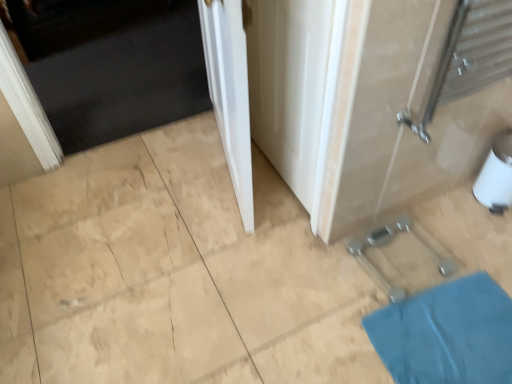
Question: Is white glossy door at upper left, which is counted as the first door, starting from the left, further to the viewer compared to blue fabric bath mat at lower right?

Choices:
 (A) no
 (B) yes

Answer: (B)

Question: Could you tell me if white glossy door at upper left, which is counted as the first door, starting from the left, is turned towards blue fabric bath mat at lower right?

Choices:
 (A) no
 (B) yes

Answer: (B)

Question: From a real-world perspective, is white glossy door at upper left, acting as the second door starting from the front, on top of blue fabric bath mat at lower right?

Choices:
 (A) yes
 (B) no

Answer: (B)

Question: From the image's perspective, is white glossy door at upper left, which is counted as the first door, starting from the left, beneath blue fabric bath mat at lower right?

Choices:
 (A) yes
 (B) no

Answer: (B)

Question: Is the depth of white glossy door at upper left, acting as the second door starting from the front, less than that of blue fabric bath mat at lower right?

Choices:
 (A) no
 (B) yes

Answer: (A)

Question: From the image's perspective, is white glossy door at upper left, which ranks as the second door in right-to-left order, on top of blue fabric bath mat at lower right?

Choices:
 (A) yes
 (B) no

Answer: (A)

Question: Does white glossy door at center appear on the left side of blue fabric bath mat at lower right?

Choices:
 (A) yes
 (B) no

Answer: (A)

Question: From the image's perspective, is white glossy door at center beneath blue fabric bath mat at lower right?

Choices:
 (A) no
 (B) yes

Answer: (A)

Question: Is white glossy door at center positioned with its back to blue fabric bath mat at lower right?

Choices:
 (A) no
 (B) yes

Answer: (A)

Question: Could you tell me if white glossy door at center is turned towards blue fabric bath mat at lower right?

Choices:
 (A) yes
 (B) no

Answer: (B)

Question: Is white glossy door at center smaller than blue fabric bath mat at lower right?

Choices:
 (A) no
 (B) yes

Answer: (A)

Question: Is white glossy door at center surrounding blue fabric bath mat at lower right?

Choices:
 (A) no
 (B) yes

Answer: (A)

Question: Considering the relative sizes of white glossy door at upper left, acting as the second door starting from the front, and white smooth door at center, the 1th door positioned from the front, in the image provided, is white glossy door at upper left, acting as the second door starting from the front, shorter than white smooth door at center, the 1th door positioned from the front,?

Choices:
 (A) yes
 (B) no

Answer: (A)